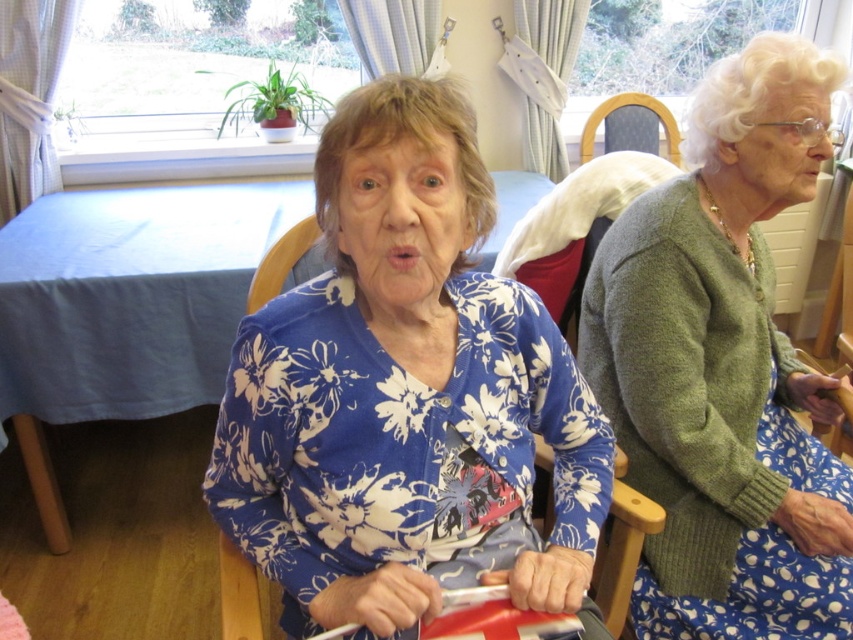
Is green woolen cardigan at right below dark brown leather chair at upper center?

Indeed, green woolen cardigan at right is positioned under dark brown leather chair at upper center.

Is point (581, 368) positioned in front of point (677, 134)?

Yes, it is.

Is point (636, 584) farther from viewer compared to point (666, 124)?

No.

The width and height of the screenshot is (853, 640). Find the location of `green woolen cardigan at right`. green woolen cardigan at right is located at coordinates (724, 369).

Can you confirm if blue floral cardigan at center is smaller than green woolen cardigan at right?

Yes, blue floral cardigan at center is smaller than green woolen cardigan at right.

Is blue floral cardigan at center to the right of green woolen cardigan at right from the viewer's perspective?

No, blue floral cardigan at center is not to the right of green woolen cardigan at right.

Where is `blue floral cardigan at center`? The height and width of the screenshot is (640, 853). blue floral cardigan at center is located at coordinates (405, 396).

At what (x,y) coordinates should I click in order to perform the action: click on blue floral cardigan at center. Please return your answer as a coordinate pair (x, y). The height and width of the screenshot is (640, 853). Looking at the image, I should click on (405, 396).

Does blue floral cardigan at center have a lesser width compared to dark brown leather chair at upper center?

In fact, blue floral cardigan at center might be wider than dark brown leather chair at upper center.

Does blue floral cardigan at center have a lesser height compared to dark brown leather chair at upper center?

No.

Who is more distant from viewer, (x=457, y=413) or (x=674, y=148)?

The point (x=674, y=148) is behind.

Where is `blue floral cardigan at center`? The width and height of the screenshot is (853, 640). blue floral cardigan at center is located at coordinates (405, 396).